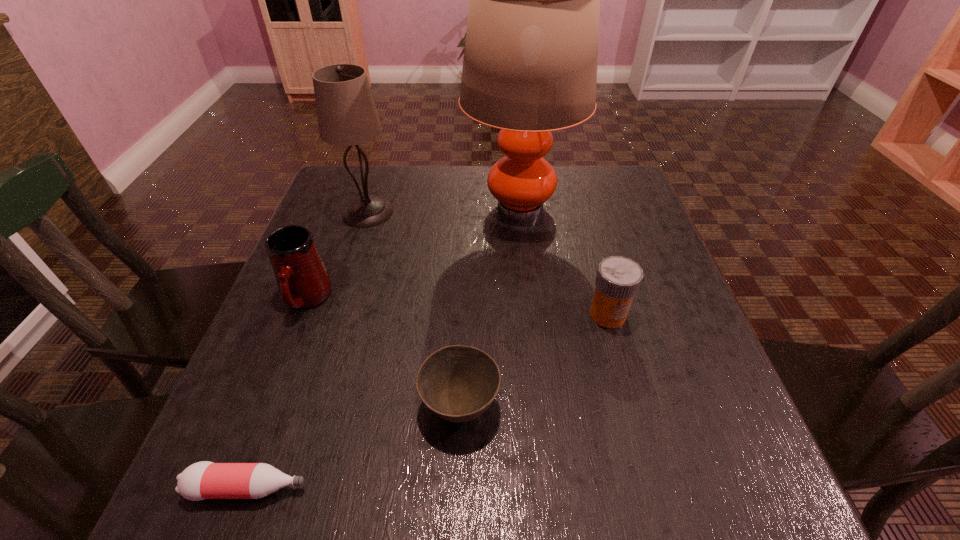
This screenshot has width=960, height=540. In order to click on object that is at the right edge in this screenshot , I will do `click(618, 279)`.

Find the location of a particular element. Image resolution: width=960 pixels, height=540 pixels. object that is at the far left corner is located at coordinates (346, 112).

I want to click on object situated at the near left corner, so click(x=203, y=480).

Identify the location of free region at the far edge of the desktop. Image resolution: width=960 pixels, height=540 pixels. (482, 199).

In the image, there is a desktop. Where is `vacant space at the near edge`? The height and width of the screenshot is (540, 960). vacant space at the near edge is located at coordinates (416, 515).

The width and height of the screenshot is (960, 540). In order to click on free space at the left edge of the desktop in this screenshot , I will do `click(247, 376)`.

Find the location of a particular element. vacant space at the right edge is located at coordinates (672, 446).

This screenshot has width=960, height=540. I want to click on free location at the far left corner of the desktop, so click(369, 191).

Where is `vacant region at the far right corner`? The image size is (960, 540). vacant region at the far right corner is located at coordinates (629, 214).

Find the location of a particular element. The height and width of the screenshot is (540, 960). blank space at the near right corner is located at coordinates (742, 480).